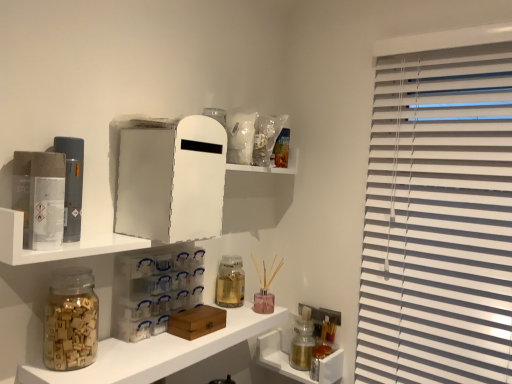
Where is `free space to the right of transparent glass jar at lower left`? This screenshot has width=512, height=384. free space to the right of transparent glass jar at lower left is located at coordinates (131, 354).